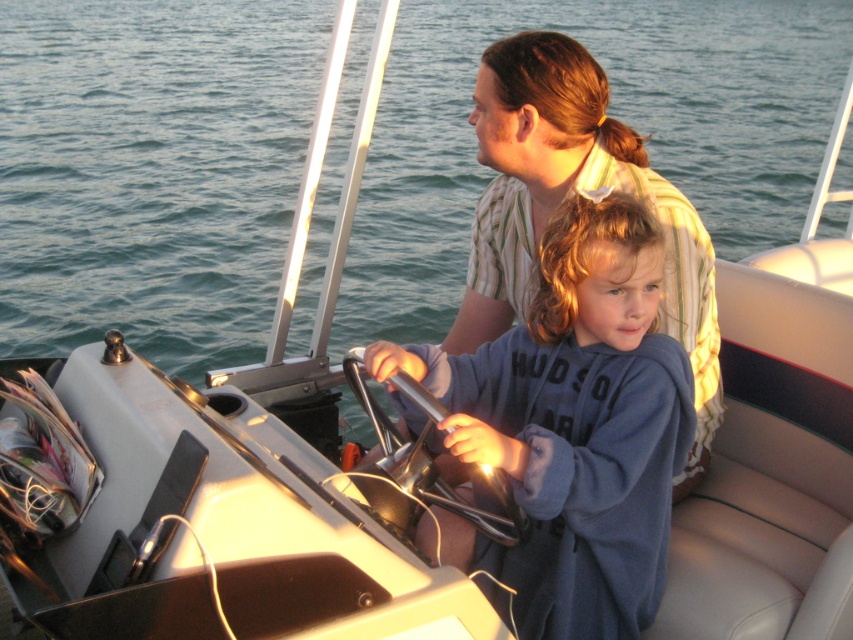
How much distance is there between blue fleece jacket at center and matte striped shirt at center?

14.76 inches

Can you confirm if blue fleece jacket at center is taller than matte striped shirt at center?

No.

This screenshot has width=853, height=640. What do you see at coordinates (573, 426) in the screenshot?
I see `blue fleece jacket at center` at bounding box center [573, 426].

Find the location of a particular element. Image resolution: width=853 pixels, height=640 pixels. blue fleece jacket at center is located at coordinates (573, 426).